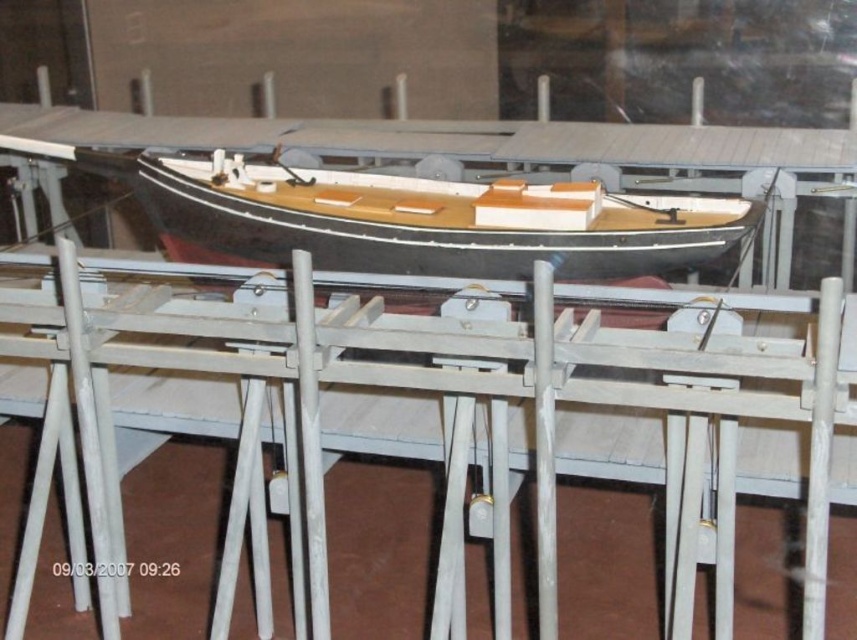
Question: Which point is farther from the camera taking this photo?

Choices:
 (A) click(712, 380)
 (B) click(160, 160)

Answer: (B)

Question: Can you confirm if white matte rail at center is smaller than wooden boat at center?

Choices:
 (A) yes
 (B) no

Answer: (B)

Question: Is white matte rail at center wider than wooden boat at center?

Choices:
 (A) no
 (B) yes

Answer: (B)

Question: Which point is farther to the camera?

Choices:
 (A) (382, 246)
 (B) (456, 289)

Answer: (A)

Question: Which point is farther from the camera taking this photo?

Choices:
 (A) (64, 326)
 (B) (156, 212)

Answer: (B)

Question: Does white matte rail at center have a lesser width compared to wooden boat at center?

Choices:
 (A) no
 (B) yes

Answer: (A)